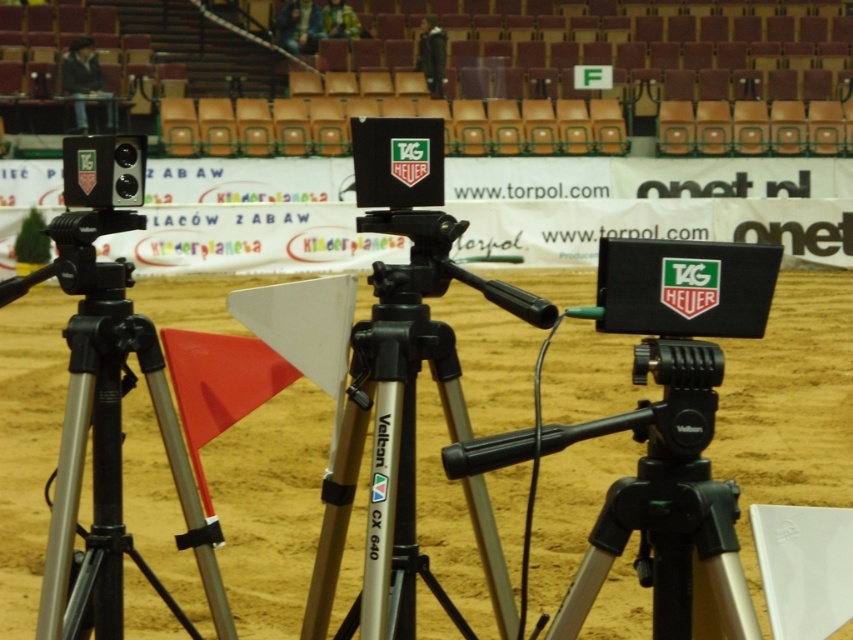
Question: Which point is farther to the camera?

Choices:
 (A) (149, 324)
 (B) (399, 636)
 (C) (62, 170)
 (D) (21, 365)

Answer: (C)

Question: Does black metallic tripod at center have a greater width compared to matte black camera at left?

Choices:
 (A) yes
 (B) no

Answer: (A)

Question: Which point is closer to the camera taking this photo?

Choices:
 (A) (497, 536)
 (B) (91, 355)
 (C) (569, 364)

Answer: (A)

Question: Does matte black camera at left have a lesser width compared to brown sand at center?

Choices:
 (A) yes
 (B) no

Answer: (A)

Question: Among these points, which one is nearest to the camera?

Choices:
 (A) (418, 552)
 (B) (126, 145)
 (C) (28, 364)
 (D) (117, 525)

Answer: (B)

Question: Does black metallic tripod at center appear over black metallic tripod at left?

Choices:
 (A) no
 (B) yes

Answer: (B)